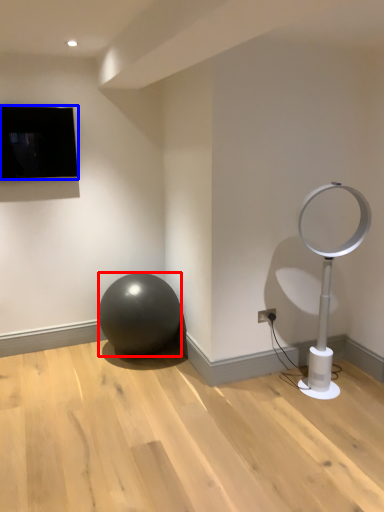
Question: Which point is further to the camera, ball (highlighted by a red box) or television (highlighted by a blue box)?

Choices:
 (A) ball
 (B) television

Answer: (B)